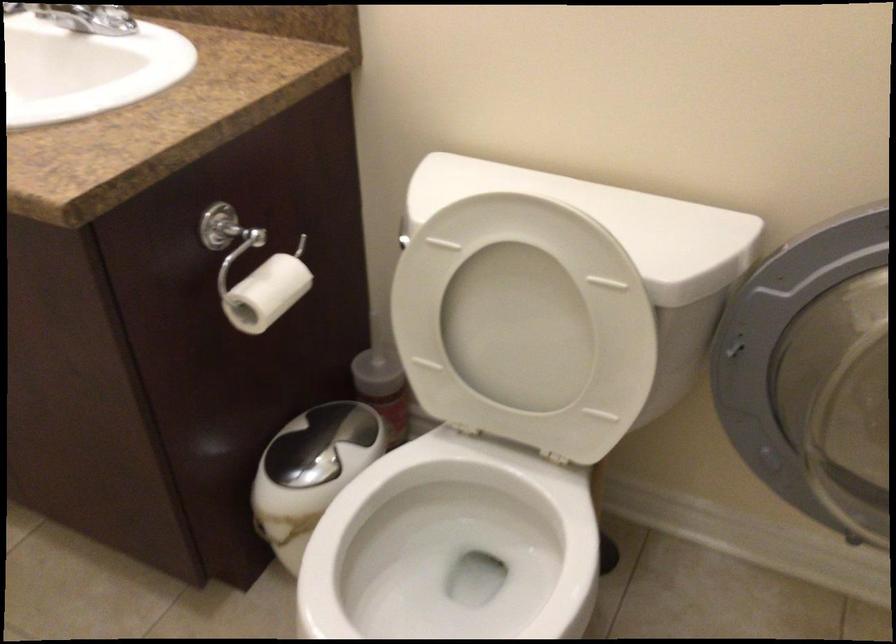
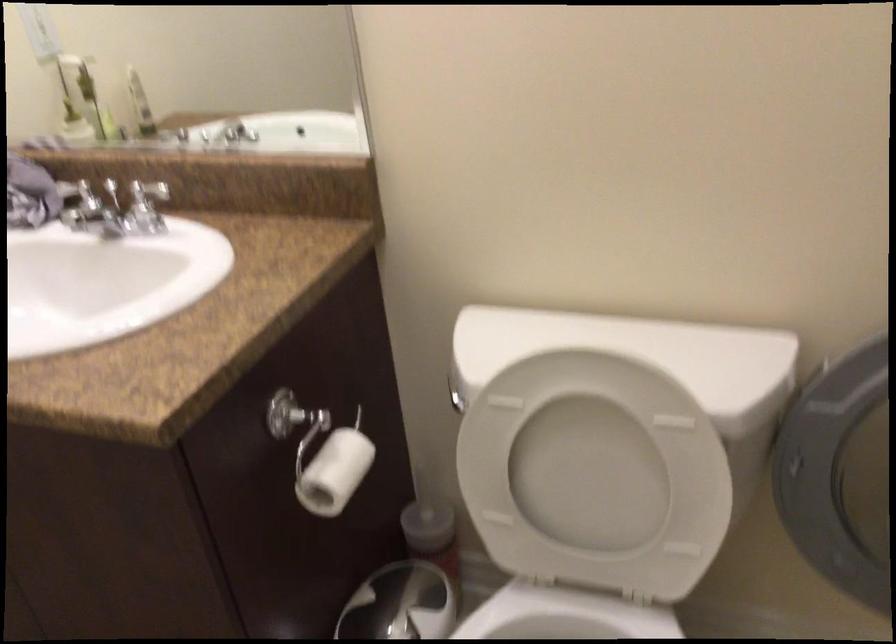
The point at (478, 469) is marked in the first image. Where is the corresponding point in the second image?

(564, 616)